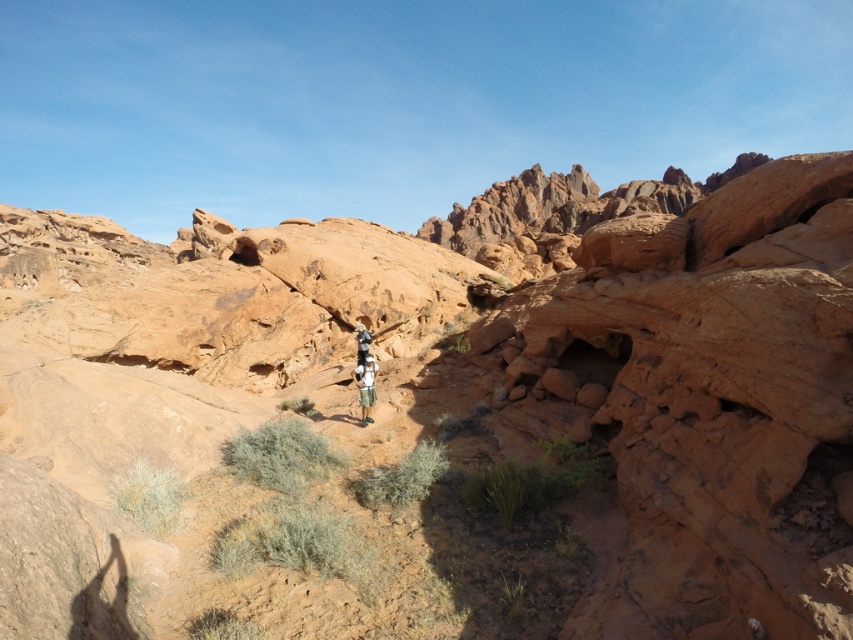
You are a photographer trying to capture the desert landscape. You notice the camouflage fabric shorts at center and the white cotton shirt at center. Which clothing item is located to the right of the other?

The camouflage fabric shorts at center is positioned on the right side of white cotton shirt at center.

You are a photographer trying to capture a photo of the camouflage fabric shorts at center in the desert scene. Based on the coordinates provided, where should you position your camera to ensure the shorts are centered in the frame?

The camouflage fabric shorts at center are located at the 2D coordinates point (366, 387), so positioning the camera to center the frame at those coordinates will ensure the shorts are centered in the photo.

Looking at this image, you are a photographer planning to capture a landscape shot of the desert scene. You have a camera with a 50mm lens and want to ensure both the camouflage fabric shorts at center and the white cotton shirt at center are in focus. Given the depth of field at this focal length, what is the minimum distance you should set the focus point to achieve sharpness for both objects?

The camouflage fabric shorts at center is 2.28 meters away from the white cotton shirt at center. To ensure both are in focus with a 50mm lens, the focus point should be set at the midpoint between them, which is approximately 1.14 meters from each object. This hyperfocal distance technique will maximize depth of field for both subjects.